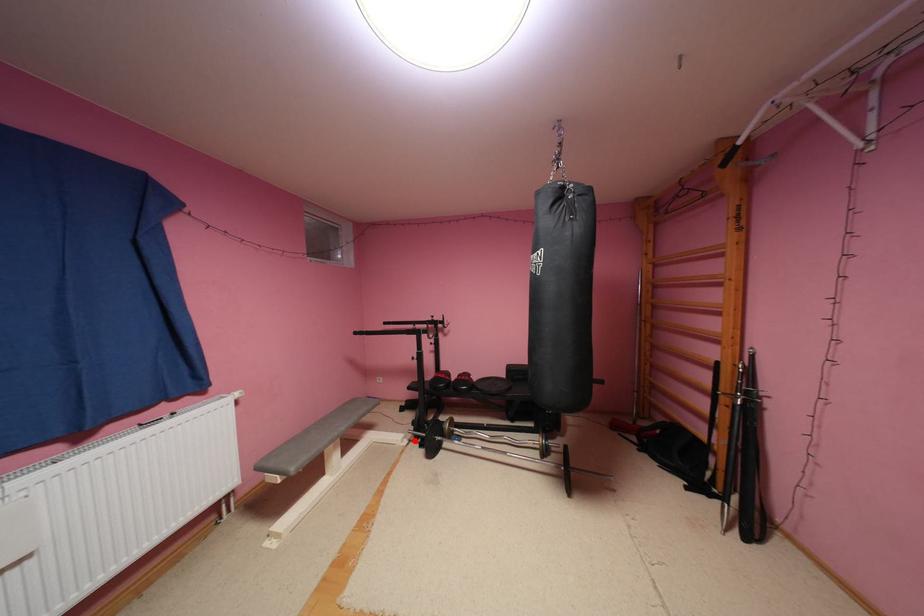
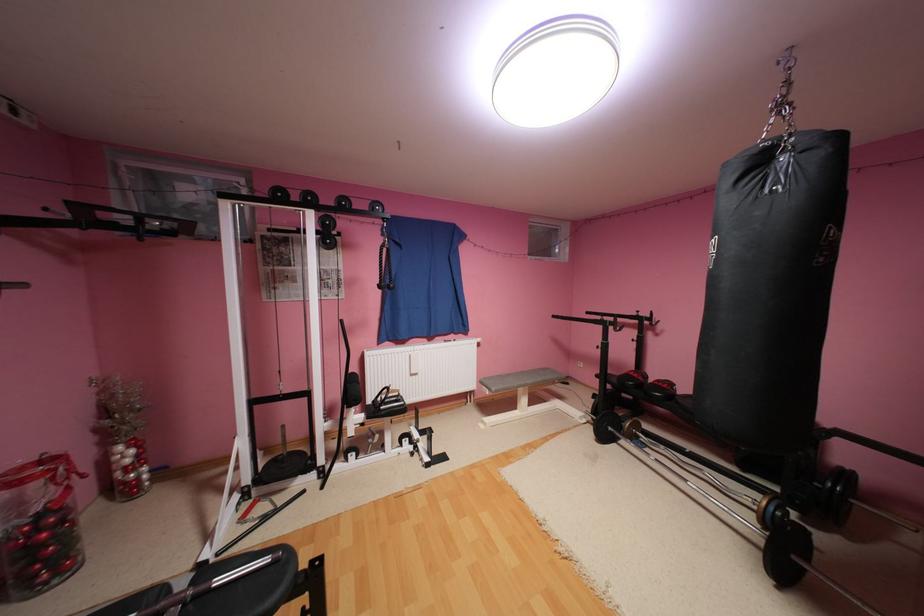
Find the pixel in the second image that matches the highlighted location in the first image.

(593, 419)